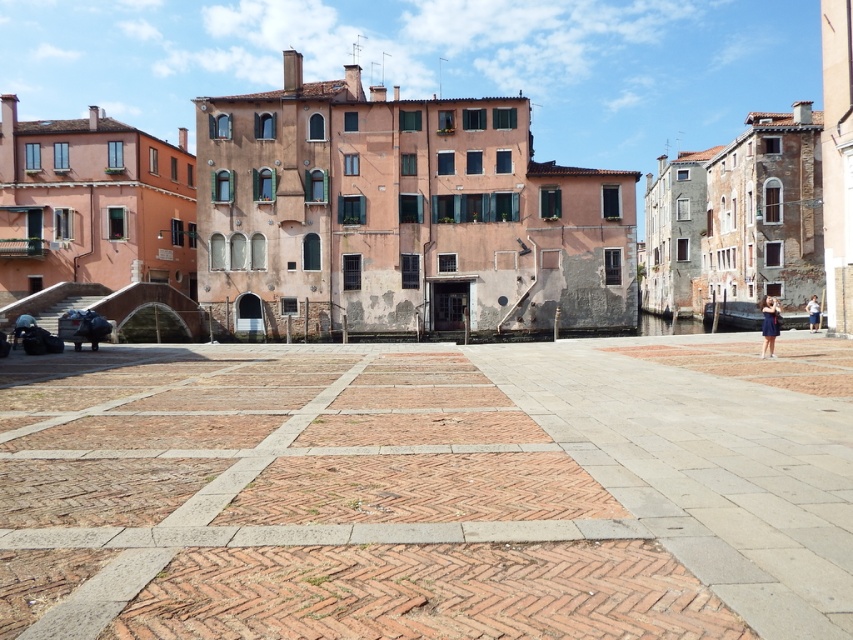
Which is below, brick at center or blue dress at lower right?

Positioned lower is brick at center.

Between brick at center and blue dress at lower right, which one appears on the left side from the viewer's perspective?

Positioned to the left is brick at center.

Does point (277, 387) lie in front of point (770, 317)?

Yes, it is.

This screenshot has height=640, width=853. I want to click on brick at center, so click(x=428, y=490).

Between brick at center and white cotton shirt at center, which one appears on the right side from the viewer's perspective?

white cotton shirt at center is more to the right.

How distant is brick at center from white cotton shirt at center?

brick at center is 23.71 meters away from white cotton shirt at center.

Based on the photo, who is more forward, (555, 499) or (811, 305)?

Point (555, 499) is more forward.

Image resolution: width=853 pixels, height=640 pixels. In order to click on brick at center in this screenshot , I will do `click(428, 490)`.

Is blue dress at lower right to the left of white cotton shirt at center from the viewer's perspective?

Correct, you'll find blue dress at lower right to the left of white cotton shirt at center.

What do you see at coordinates (769, 324) in the screenshot?
I see `blue dress at lower right` at bounding box center [769, 324].

Find the location of `blue dress at lower right`. blue dress at lower right is located at coordinates (769, 324).